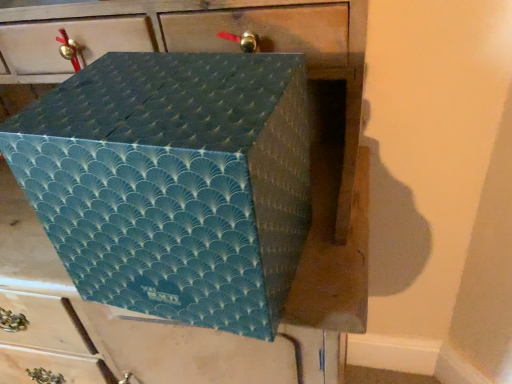
Where is `teal textured box at center`? The width and height of the screenshot is (512, 384). teal textured box at center is located at coordinates (313, 204).

Describe the element at coordinates (313, 204) in the screenshot. I see `teal textured box at center` at that location.

What is the approximate height of teal textured box at center?

11.30 inches.

I want to click on teal textured box at center, so click(x=313, y=204).